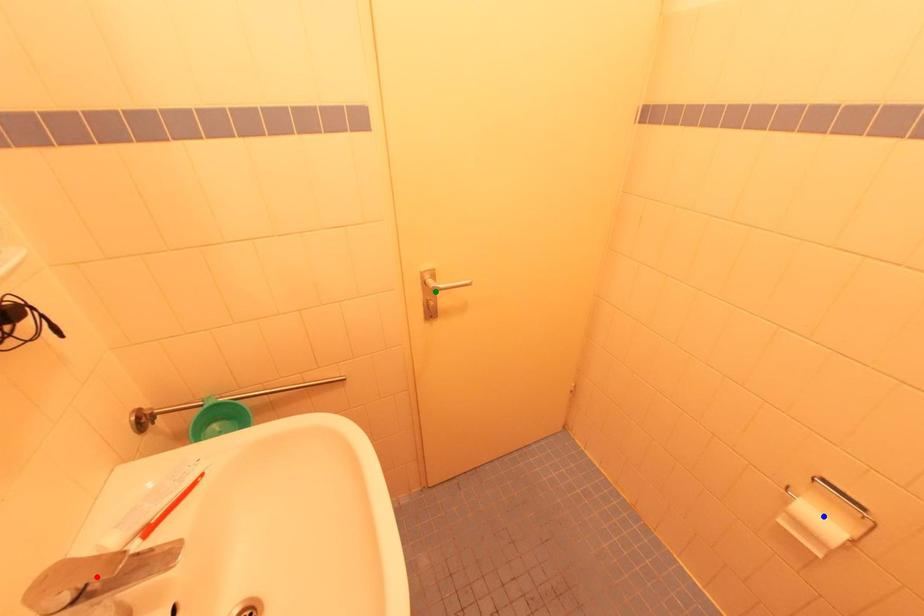
Order these from farthest to nearest:
A) red point
B) blue point
C) green point

green point, blue point, red point